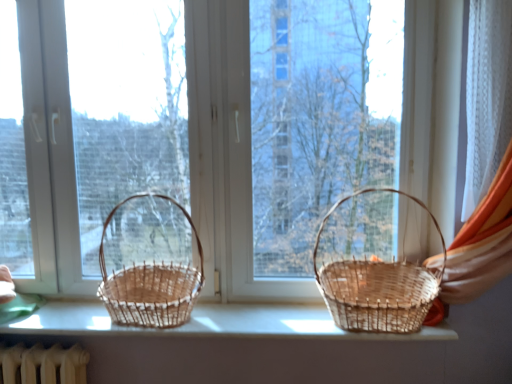
Question: Does natural wood baskets at center have a lesser width compared to woven brown picnic basket at left, which ranks as the 2th picnic basket in right-to-left order?

Choices:
 (A) no
 (B) yes

Answer: (B)

Question: Does natural wood baskets at center have a greater width compared to woven brown picnic basket at left, which ranks as the 1th picnic basket in left-to-right order?

Choices:
 (A) yes
 (B) no

Answer: (B)

Question: Is natural wood baskets at center facing towards woven brown picnic basket at left, which ranks as the 2th picnic basket in right-to-left order?

Choices:
 (A) no
 (B) yes

Answer: (B)

Question: Does natural wood baskets at center contain woven brown picnic basket at left, which ranks as the 1th picnic basket in left-to-right order?

Choices:
 (A) yes
 (B) no

Answer: (B)

Question: From a real-world perspective, is natural wood baskets at center located beneath woven brown picnic basket at left, which ranks as the 1th picnic basket in left-to-right order?

Choices:
 (A) no
 (B) yes

Answer: (A)

Question: Is natural wood baskets at center placed right next to woven brown picnic basket at left, which ranks as the 1th picnic basket in left-to-right order?

Choices:
 (A) yes
 (B) no

Answer: (B)

Question: From a real-world perspective, is woven brown picnic basket at left, which ranks as the 2th picnic basket in right-to-left order, located beneath natural wood baskets at center?

Choices:
 (A) no
 (B) yes

Answer: (B)

Question: Can you confirm if woven brown picnic basket at left, which ranks as the 1th picnic basket in left-to-right order, is thinner than natural wood baskets at center?

Choices:
 (A) yes
 (B) no

Answer: (B)

Question: Is woven brown picnic basket at left, which ranks as the 2th picnic basket in right-to-left order, smaller than natural wood baskets at center?

Choices:
 (A) no
 (B) yes

Answer: (B)

Question: Considering the relative sizes of woven brown picnic basket at left, which ranks as the 1th picnic basket in left-to-right order, and natural wood baskets at center in the image provided, is woven brown picnic basket at left, which ranks as the 1th picnic basket in left-to-right order, shorter than natural wood baskets at center?

Choices:
 (A) no
 (B) yes

Answer: (B)

Question: From the image's perspective, would you say woven brown picnic basket at left, which ranks as the 1th picnic basket in left-to-right order, is shown under natural wood baskets at center?

Choices:
 (A) no
 (B) yes

Answer: (B)

Question: Is woven brown picnic basket at left, which ranks as the 1th picnic basket in left-to-right order, wider than natural wood baskets at center?

Choices:
 (A) yes
 (B) no

Answer: (A)

Question: From a real-world perspective, is woven natural basket at right, placed as the 1th picnic basket when sorted from right to left, below woven wood baskets at center?

Choices:
 (A) yes
 (B) no

Answer: (B)